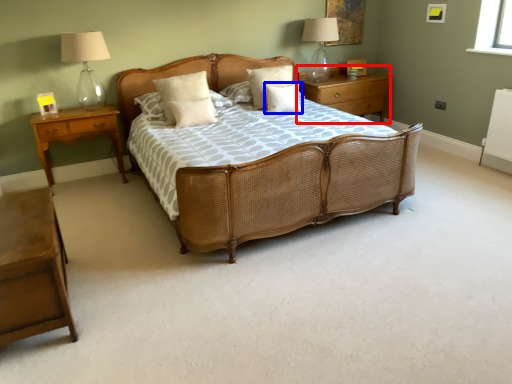
Question: Which object is further to the camera taking this photo, nightstand (highlighted by a red box) or pillow (highlighted by a blue box)?

Choices:
 (A) nightstand
 (B) pillow

Answer: (A)